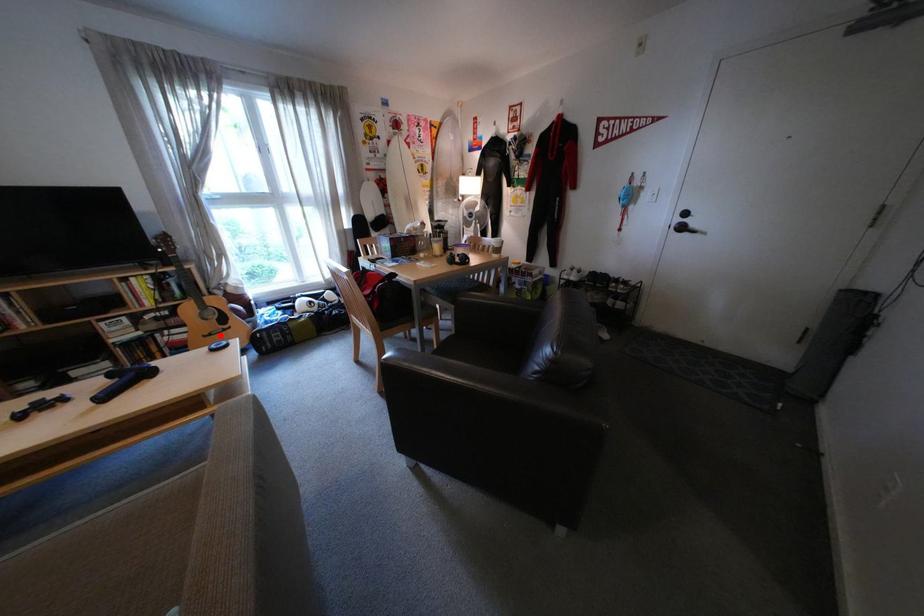
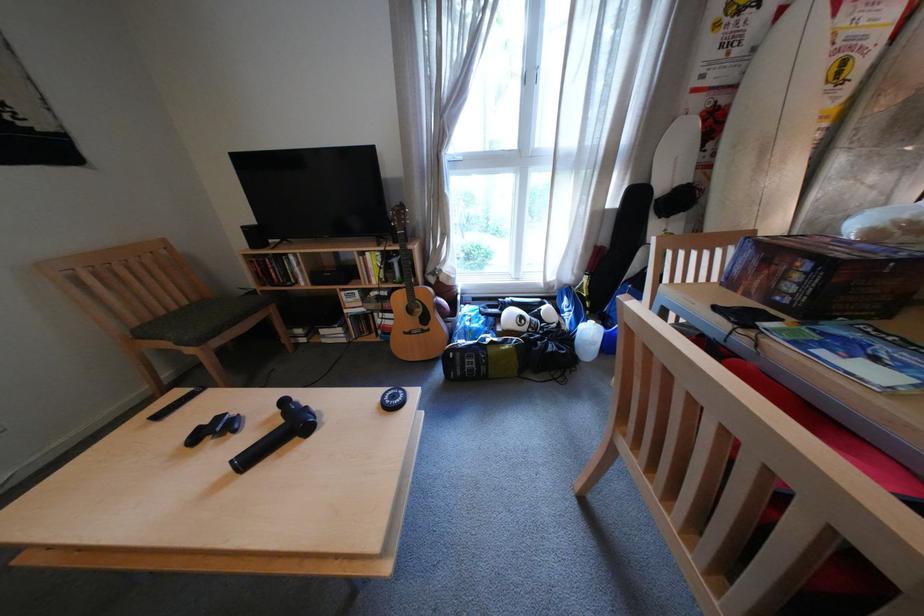
Locate, in the second image, the point that corresponds to the highlighted location in the first image.

(420, 331)